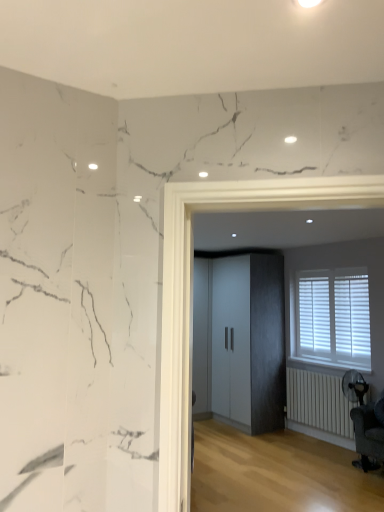
Measure the distance between point (357, 344) and camera.

The depth of point (357, 344) is 4.79 meters.

Find the location of `matte gray cabinet at center`. matte gray cabinet at center is located at coordinates (240, 341).

This screenshot has width=384, height=512. I want to click on white wood blinds at right, so click(331, 318).

Is matte gray cabinet at center turned away from white matte radiator at lower right?

matte gray cabinet at center does not have its back to white matte radiator at lower right.

Is matte gray cabinet at center shorter than white matte radiator at lower right?

No, matte gray cabinet at center is not shorter than white matte radiator at lower right.

Would you say matte gray cabinet at center is a long distance from white matte radiator at lower right?

No, there isn't a large distance between matte gray cabinet at center and white matte radiator at lower right.

From the image's perspective, which is below, matte gray cabinet at center or white matte radiator at lower right?

white matte radiator at lower right appears lower in the image.

Is white matte radiator at lower right bigger than matte gray cabinet at center?

Actually, white matte radiator at lower right might be smaller than matte gray cabinet at center.

From a real-world perspective, who is located lower, white matte radiator at lower right or matte gray cabinet at center?

white matte radiator at lower right.

From the image's perspective, which is above, white matte radiator at lower right or matte gray cabinet at center?

matte gray cabinet at center.

Based on the photo, considering the positions of objects white wood blinds at right and dark gray fabric swivel chair at lower right in the image provided, who is more to the right, white wood blinds at right or dark gray fabric swivel chair at lower right?

dark gray fabric swivel chair at lower right.

Is white wood blinds at right completely or partially outside of dark gray fabric swivel chair at lower right?

Yes, white wood blinds at right is not within dark gray fabric swivel chair at lower right.

From the image's perspective, is white wood blinds at right below dark gray fabric swivel chair at lower right?

No, from the image's perspective, white wood blinds at right is not below dark gray fabric swivel chair at lower right.

Identify the location of swivel chair below the white wood blinds at right (from the image's perspective). (367, 437).

Considering the sizes of objects white matte radiator at lower right and white wood blinds at right in the image provided, who is shorter, white matte radiator at lower right or white wood blinds at right?

white matte radiator at lower right.

Is white matte radiator at lower right bigger than white wood blinds at right?

No, white matte radiator at lower right is not bigger than white wood blinds at right.

Locate an element on the screen. window that is above the white matte radiator at lower right (from the image's perspective) is located at coordinates (331, 318).

From a real-world perspective, which is physically below, white matte radiator at lower right or white wood blinds at right?

white matte radiator at lower right.

From the image's perspective, is white matte radiator at lower right above or below dark gray fabric swivel chair at lower right?

From the image's perspective, white matte radiator at lower right appears below dark gray fabric swivel chair at lower right.

Could you measure the distance between white matte radiator at lower right and dark gray fabric swivel chair at lower right?

75.77 centimeters.

Is white matte radiator at lower right looking in the opposite direction of dark gray fabric swivel chair at lower right?

No, white matte radiator at lower right is not facing away from dark gray fabric swivel chair at lower right.

Considering the relative positions of white matte radiator at lower right and dark gray fabric swivel chair at lower right in the image provided, is white matte radiator at lower right to the left of dark gray fabric swivel chair at lower right from the viewer's perspective?

Yes, white matte radiator at lower right is to the left of dark gray fabric swivel chair at lower right.

The image size is (384, 512). Find the location of `elevator to the left of dark gray fabric swivel chair at lower right`. elevator to the left of dark gray fabric swivel chair at lower right is located at coordinates click(x=240, y=341).

Considering the sizes of objects dark gray fabric swivel chair at lower right and matte gray cabinet at center in the image provided, who is taller, dark gray fabric swivel chair at lower right or matte gray cabinet at center?

Standing taller between the two is matte gray cabinet at center.

Is dark gray fabric swivel chair at lower right inside or outside of matte gray cabinet at center?

dark gray fabric swivel chair at lower right is not inside matte gray cabinet at center, it's outside.

Is dark gray fabric swivel chair at lower right bigger than matte gray cabinet at center?

Actually, dark gray fabric swivel chair at lower right might be smaller than matte gray cabinet at center.

Which is correct: dark gray fabric swivel chair at lower right is inside white matte radiator at lower right, or outside of it?

dark gray fabric swivel chair at lower right lies outside white matte radiator at lower right.

Is white matte radiator at lower right at the back of dark gray fabric swivel chair at lower right?

That's not correct — dark gray fabric swivel chair at lower right is not looking away from white matte radiator at lower right.

Can you confirm if dark gray fabric swivel chair at lower right is positioned to the right of white matte radiator at lower right?

Indeed, dark gray fabric swivel chair at lower right is positioned on the right side of white matte radiator at lower right.

Locate an element on the screen. elevator above the white matte radiator at lower right (from a real-world perspective) is located at coordinates (240, 341).

I want to click on elevator lying behind the white matte radiator at lower right, so click(x=240, y=341).

Looking at the image, which one is located closer to dark gray fabric swivel chair at lower right, white matte radiator at lower right or matte gray cabinet at center?

Among the two, white matte radiator at lower right is located nearer to dark gray fabric swivel chair at lower right.

When comparing their distances from dark gray fabric swivel chair at lower right, does white matte radiator at lower right or white wood blinds at right seem closer?

white matte radiator at lower right is closer to dark gray fabric swivel chair at lower right.

Looking at the image, which one is located further to dark gray fabric swivel chair at lower right, white wood blinds at right or matte gray cabinet at center?

Based on the image, matte gray cabinet at center appears to be further to dark gray fabric swivel chair at lower right.

Based on the photo, which object lies further to the anchor point white wood blinds at right, white matte radiator at lower right or dark gray fabric swivel chair at lower right?

Based on the image, dark gray fabric swivel chair at lower right appears to be further to white wood blinds at right.

Looking at the image, which one is located further to matte gray cabinet at center, white matte radiator at lower right or dark gray fabric swivel chair at lower right?

dark gray fabric swivel chair at lower right is positioned further to the anchor matte gray cabinet at center.

From the image, which object appears to be nearer to white wood blinds at right, white matte radiator at lower right or matte gray cabinet at center?

white matte radiator at lower right.

From the image, which object appears to be nearer to matte gray cabinet at center, white wood blinds at right or dark gray fabric swivel chair at lower right?

white wood blinds at right.

Looking at the image, which one is located further to white wood blinds at right, dark gray fabric swivel chair at lower right or matte gray cabinet at center?

dark gray fabric swivel chair at lower right.

Locate an element on the screen. The image size is (384, 512). window located between dark gray fabric swivel chair at lower right and matte gray cabinet at center in the depth direction is located at coordinates (331, 318).

Locate an element on the screen. radiator between dark gray fabric swivel chair at lower right and matte gray cabinet at center from front to back is located at coordinates (319, 402).

Image resolution: width=384 pixels, height=512 pixels. Identify the location of swivel chair that lies between white wood blinds at right and white matte radiator at lower right from top to bottom. (367, 437).

This screenshot has height=512, width=384. What are the coordinates of `radiator located between matte gray cabinet at center and white wood blinds at right in the left-right direction` in the screenshot? It's located at (319, 402).